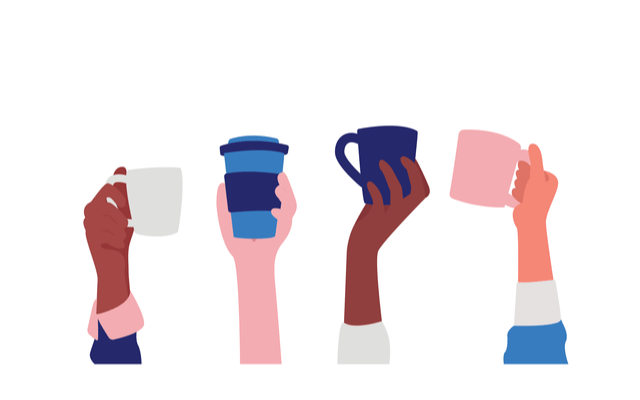
The height and width of the screenshot is (400, 640). What are the coordinates of `coffee cups` in the screenshot? It's located at (164, 211), (241, 175), (383, 142), (484, 157).